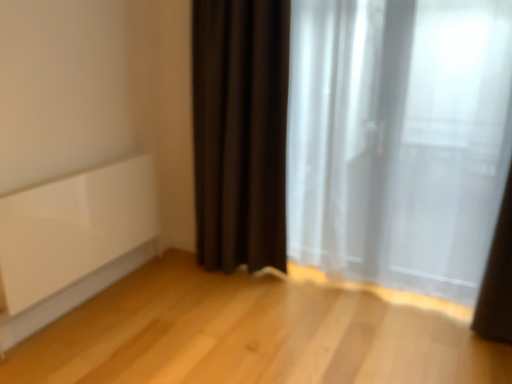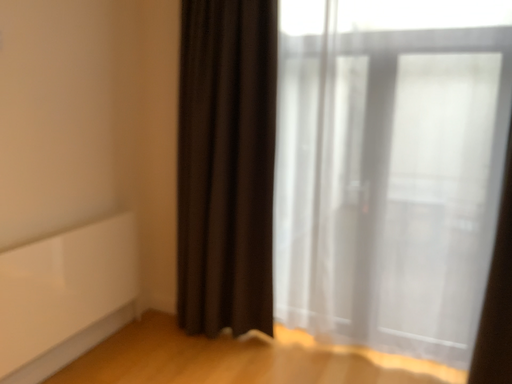
Question: How did the camera likely rotate when shooting the video?

Choices:
 (A) rotated upward
 (B) rotated downward

Answer: (A)